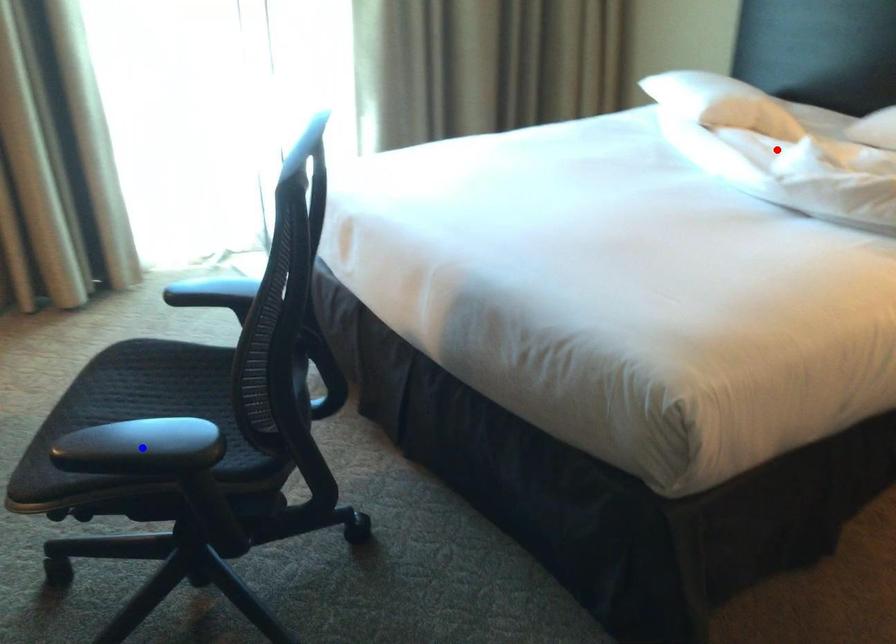
Question: Which of the two points in the image is closer to the camera?

Choices:
 (A) Blue point is closer.
 (B) Red point is closer.

Answer: (A)